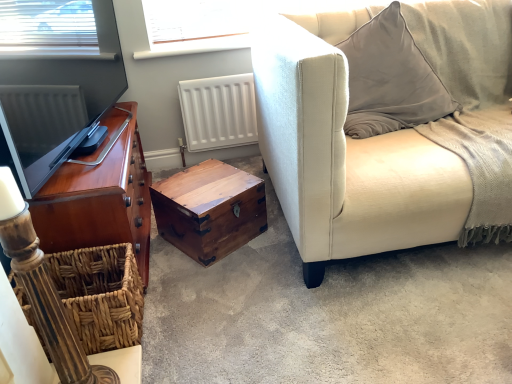
This screenshot has height=384, width=512. Describe the element at coordinates (327, 313) in the screenshot. I see `wooden trunk at center` at that location.

Measure the distance between point (119, 182) and camera.

A distance of 4.30 feet exists between point (119, 182) and camera.

At what (x,y) coordinates should I click in order to perform the action: click on wooden chest at center. Please return your answer as a coordinate pair (x, y). Looking at the image, I should click on (210, 209).

Image resolution: width=512 pixels, height=384 pixels. What do you see at coordinates (388, 126) in the screenshot?
I see `suede beige couch at right` at bounding box center [388, 126].

I want to click on wooden trunk at center, so click(x=327, y=313).

Are suede beige couch at right and shiny brown wood cabinet at left located far from each other?

No.

Which of these two, suede beige couch at right or shiny brown wood cabinet at left, is thinner?

shiny brown wood cabinet at left.

Which is more to the right, suede beige couch at right or shiny brown wood cabinet at left?

suede beige couch at right.

Is wooden chest at center positioned far away from woven brown basket at lower left?

They are positioned close to each other.

Which object is thinner, wooden chest at center or woven brown basket at lower left?

wooden chest at center is thinner.

Can you tell me how much wooden chest at center and woven brown basket at lower left differ in facing direction?

58.2 degrees separate the facing orientations of wooden chest at center and woven brown basket at lower left.

Could you tell me if wooden chest at center is facing woven brown basket at lower left?

No, wooden chest at center is not oriented towards woven brown basket at lower left.

Is woven brown basket at lower left facing towards shiny brown wood cabinet at left?

No, woven brown basket at lower left is not aimed at shiny brown wood cabinet at left.

From the image's perspective, which object appears higher, woven brown basket at lower left or shiny brown wood cabinet at left?

shiny brown wood cabinet at left is shown above in the image.

In terms of height, does woven brown basket at lower left look taller or shorter compared to shiny brown wood cabinet at left?

Considering their sizes, woven brown basket at lower left has less height than shiny brown wood cabinet at left.

Is point (106, 263) closer or farther from the camera than point (54, 226)?

Point (106, 263).

From a real-world perspective, is wooden trunk at center positioned above or below woven brown basket at lower left?

From a real-world perspective, wooden trunk at center is physically below woven brown basket at lower left.

Would you say wooden trunk at center is outside woven brown basket at lower left?

wooden trunk at center is positioned outside woven brown basket at lower left.

From the image's perspective, between wooden trunk at center and woven brown basket at lower left, which one is located above?

wooden trunk at center appears higher in the image.

Can you tell me how much suede beige couch at right and woven brown basket at lower left differ in facing direction?

There is a 90.7-degree angle between the facing directions of suede beige couch at right and woven brown basket at lower left.

Looking at this image, considering the sizes of suede beige couch at right and woven brown basket at lower left in the image, is suede beige couch at right wider or thinner than woven brown basket at lower left?

Considering their sizes, suede beige couch at right looks broader than woven brown basket at lower left.

Who is taller, suede beige couch at right or woven brown basket at lower left?

Standing taller between the two is suede beige couch at right.

Is suede beige couch at right spatially inside wooden trunk at center, or outside of it?

suede beige couch at right is spatially situated outside wooden trunk at center.

Which is farther, (374, 126) or (244, 345)?

The point (374, 126) is behind.

From the image's perspective, is suede beige couch at right above wooden trunk at center?

Yes.

Does suede beige couch at right have a greater width compared to wooden trunk at center?

No.

Which object is more forward, shiny brown wood cabinet at left or wooden chest at center?

shiny brown wood cabinet at left is more forward.

Is shiny brown wood cabinet at left not near wooden chest at center?

No, shiny brown wood cabinet at left is in close proximity to wooden chest at center.

Is shiny brown wood cabinet at left turned away from wooden chest at center?

No, shiny brown wood cabinet at left is not facing away from wooden chest at center.

Between point (85, 204) and point (234, 209), which one is positioned in front?

The point (85, 204) is closer to the camera.

The width and height of the screenshot is (512, 384). Find the location of `studio couch lying in front of the shiny brown wood cabinet at left`. studio couch lying in front of the shiny brown wood cabinet at left is located at coordinates (388, 126).

The image size is (512, 384). I want to click on crate on the left of wooden chest at center, so click(x=101, y=294).

From the image, which object appears to be farther from wooden trunk at center, shiny brown wood cabinet at left or wooden chest at center?

Based on the image, shiny brown wood cabinet at left appears to be further to wooden trunk at center.

Considering their positions, is suede beige couch at right positioned further to wooden chest at center than woven brown basket at lower left?

Among the two, suede beige couch at right is located further to wooden chest at center.

From the picture: Looking at the image, which one is located closer to suede beige couch at right, wooden trunk at center or wooden chest at center?

wooden trunk at center.

Estimate the real-world distances between objects in this image. Which object is further from shiny brown wood cabinet at left, woven brown basket at lower left or wooden chest at center?

The object further to shiny brown wood cabinet at left is wooden chest at center.

Which object lies further to the anchor point wooden chest at center, shiny brown wood cabinet at left or wooden trunk at center?

Based on the image, wooden trunk at center appears to be further to wooden chest at center.

Looking at the image, which one is located closer to shiny brown wood cabinet at left, wooden chest at center or woven brown basket at lower left?

woven brown basket at lower left is closer to shiny brown wood cabinet at left.

Estimate the real-world distances between objects in this image. Which object is further from suede beige couch at right, shiny brown wood cabinet at left or wooden chest at center?

shiny brown wood cabinet at left lies further to suede beige couch at right than the other object.

In the scene shown: When comparing their distances from suede beige couch at right, does wooden trunk at center or shiny brown wood cabinet at left seem further?

shiny brown wood cabinet at left is further to suede beige couch at right.

At what (x,y) coordinates should I click in order to perform the action: click on concrete located between wooden chest at center and suede beige couch at right in the left-right direction. Please return your answer as a coordinate pair (x, y). The height and width of the screenshot is (384, 512). Looking at the image, I should click on (327, 313).

This screenshot has height=384, width=512. In order to click on crate between shiny brown wood cabinet at left and suede beige couch at right from left to right in this screenshot , I will do `click(101, 294)`.

The width and height of the screenshot is (512, 384). I want to click on chest between shiny brown wood cabinet at left and suede beige couch at right from left to right, so click(210, 209).

You are a GUI agent. You are given a task and a screenshot of the screen. Output one action in this format:
    pyautogui.click(x=<x>, y=<y>)
    Task: Click on the concrete situated between woven brown basket at lower left and suede beige couch at right from left to right
    
    Given the screenshot: What is the action you would take?
    pyautogui.click(x=327, y=313)